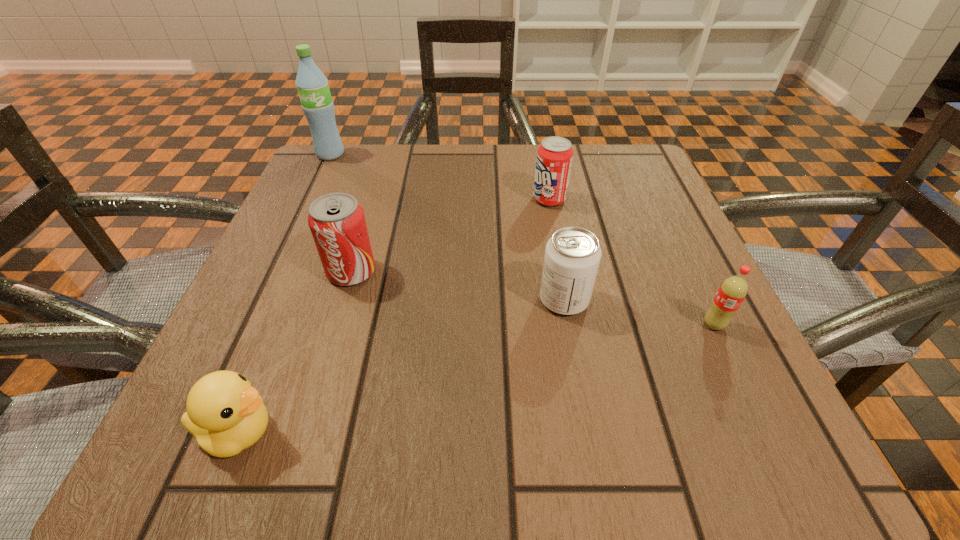
Find the location of a particular element. Image resolution: width=960 pixels, height=540 pixels. object at the far left corner is located at coordinates coord(312,85).

This screenshot has height=540, width=960. In order to click on object located at the near left corner in this screenshot , I will do `click(225, 413)`.

In the image, there is a desktop. Where is `vacant space at the far edge`? The width and height of the screenshot is (960, 540). vacant space at the far edge is located at coordinates (522, 193).

In order to click on free space at the left edge of the desktop in this screenshot , I will do (x=254, y=387).

In the image, there is a desktop. Identify the location of free space at the right edge. The width and height of the screenshot is (960, 540). (657, 212).

In the image, there is a desktop. Where is `free region at the far left corner`? free region at the far left corner is located at coordinates (345, 183).

Locate an element on the screen. This screenshot has width=960, height=540. vacant space at the far right corner of the desktop is located at coordinates (643, 165).

Locate an element on the screen. free location at the near right corner of the desktop is located at coordinates (767, 438).

Identify the location of vacant region between the leftmost soda and the fifth nearest object. Image resolution: width=960 pixels, height=540 pixels. (450, 235).

Where is `blank region between the nearest object and the fifth nearest object`? This screenshot has height=540, width=960. blank region between the nearest object and the fifth nearest object is located at coordinates (394, 316).